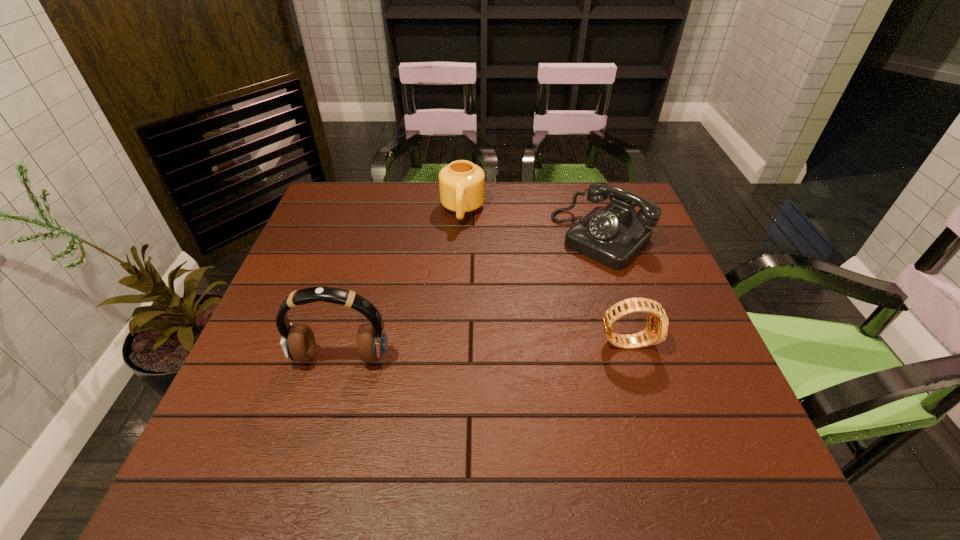
At what (x,y) coordinates should I click in order to perform the action: click on vacant space situated on the handle side of the second object from left to right. Please return your answer as a coordinate pair (x, y). This screenshot has width=960, height=540. Looking at the image, I should click on (460, 239).

Find the location of a particular element. vacant space located 0.140m on the handle side of the second object from left to right is located at coordinates (457, 259).

This screenshot has height=540, width=960. What are the coordinates of `telephone at the far edge` in the screenshot? It's located at (613, 235).

The image size is (960, 540). What are the coordinates of `mug that is positioned at the far edge` in the screenshot? It's located at [x=461, y=183].

Where is `object situated at the left edge`? object situated at the left edge is located at coordinates (298, 342).

This screenshot has width=960, height=540. Identify the location of watch located at the right edge. (656, 331).

Image resolution: width=960 pixels, height=540 pixels. I want to click on telephone located at the right edge, so click(613, 235).

Locate an element on the screen. object located in the far right corner section of the desktop is located at coordinates (613, 235).

In the image, there is a desktop. Where is `free region at the far edge`? The width and height of the screenshot is (960, 540). free region at the far edge is located at coordinates (582, 203).

This screenshot has width=960, height=540. Identify the location of free space at the near edge of the desktop. (429, 424).